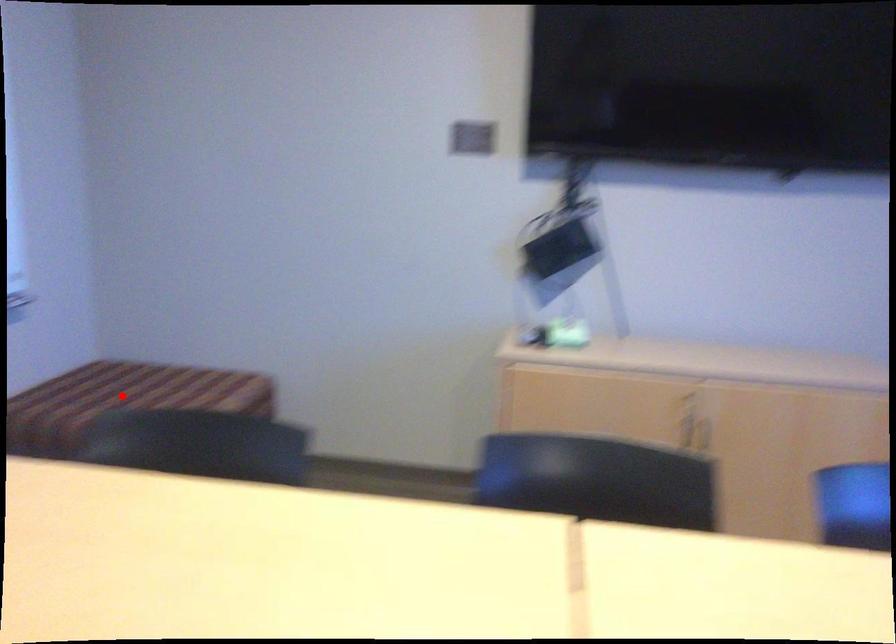
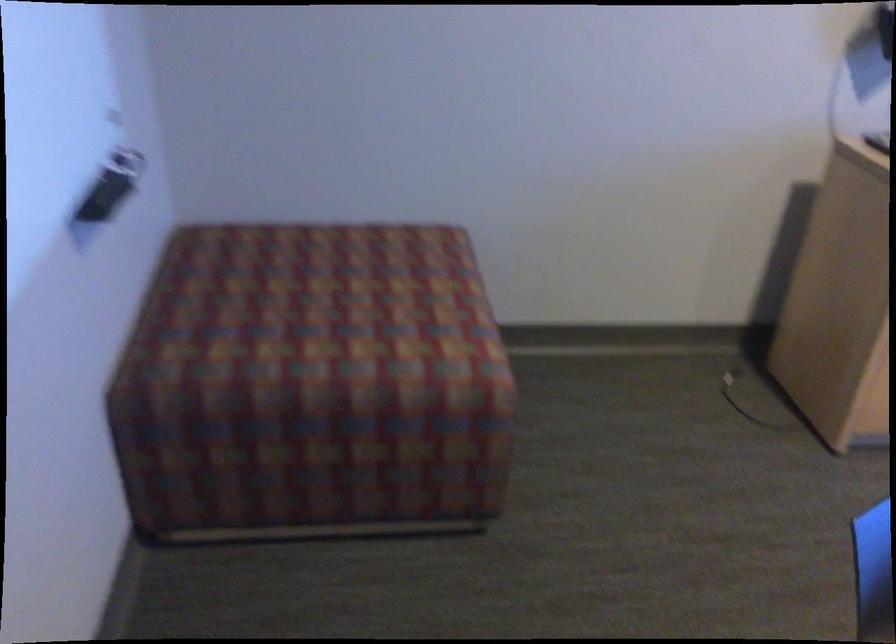
Question: I am providing you with two images of the same scene from different viewpoints. In image1, a red point is highlighted. Considering the same 3D point in image2, which of the following is correct?

Choices:
 (A) It is closer
 (B) It is farther

Answer: (A)